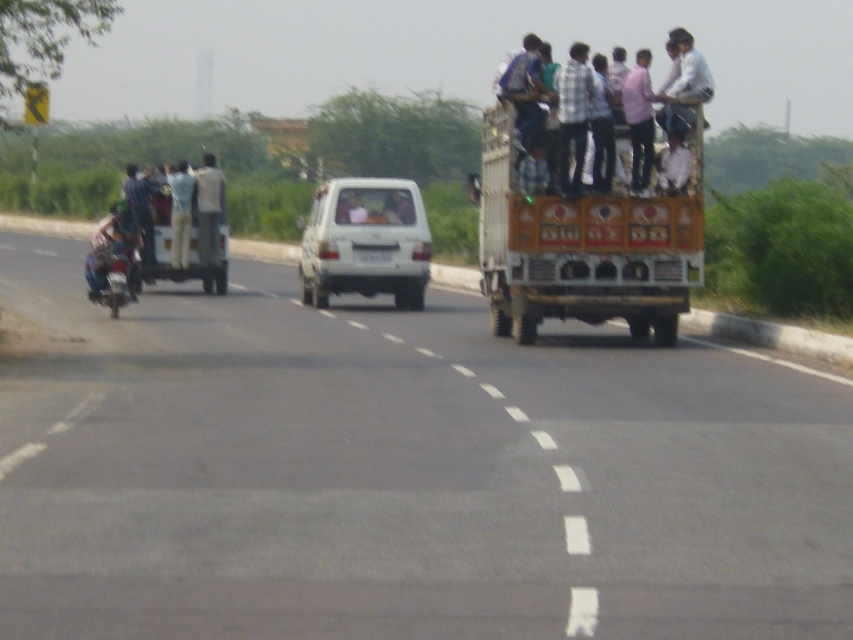
Question: Based on their relative distances, which object is farther from the white matte van at center?

Choices:
 (A) pink shirt at upper center
 (B) white glossy van at center
 (C) plaid fabric shirt at center

Answer: (A)

Question: Can you confirm if white matte van at center is thinner than plaid fabric shirt at center?

Choices:
 (A) yes
 (B) no

Answer: (A)

Question: Which point is farther to the camera?

Choices:
 (A) (360, 216)
 (B) (183, 246)

Answer: (B)

Question: Is white matte van at center bigger than plaid fabric shirt at center?

Choices:
 (A) yes
 (B) no

Answer: (B)

Question: Which of these objects is positioned farthest from the pink shirt at upper center?

Choices:
 (A) white glossy van at center
 (B) white matte van at center
 (C) metallic silver motorcycle at left

Answer: (C)

Question: Does white matte van at center appear over plaid fabric shirt at center?

Choices:
 (A) yes
 (B) no

Answer: (B)